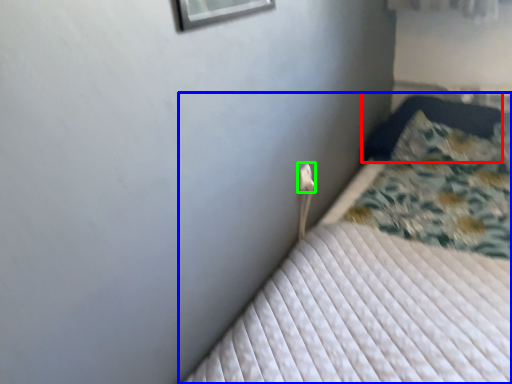
Question: Which is nearer to the pillow (highlighted by a red box)? bed (highlighted by a blue box) or electric outlet (highlighted by a green box).

Choices:
 (A) bed
 (B) electric outlet

Answer: (A)